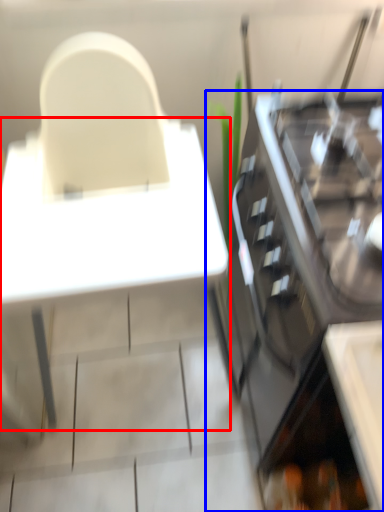
Question: Which point is closer to the camera, table (highlighted by a red box) or cabinetry (highlighted by a blue box)?

Choices:
 (A) table
 (B) cabinetry

Answer: (A)